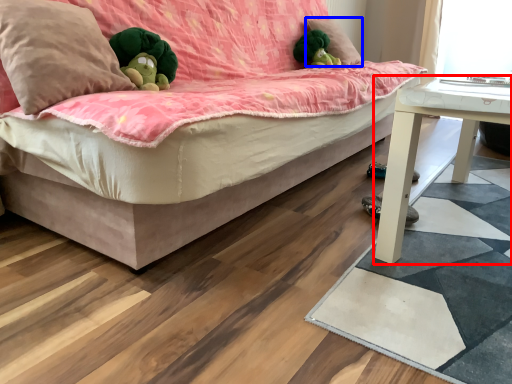
Question: Which object appears closest to the camera in this image, table (highlighted by a red box) or pillow (highlighted by a blue box)?

Choices:
 (A) table
 (B) pillow

Answer: (A)